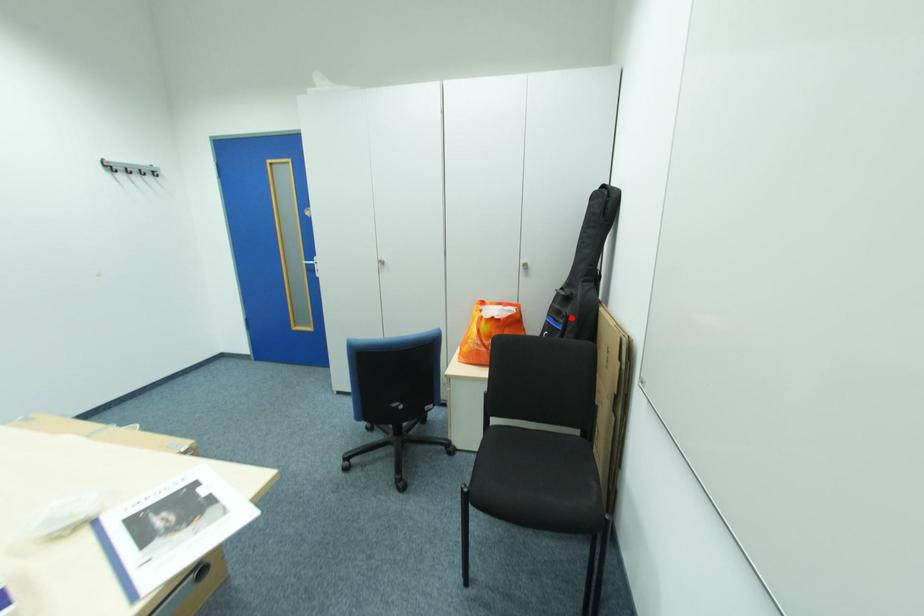
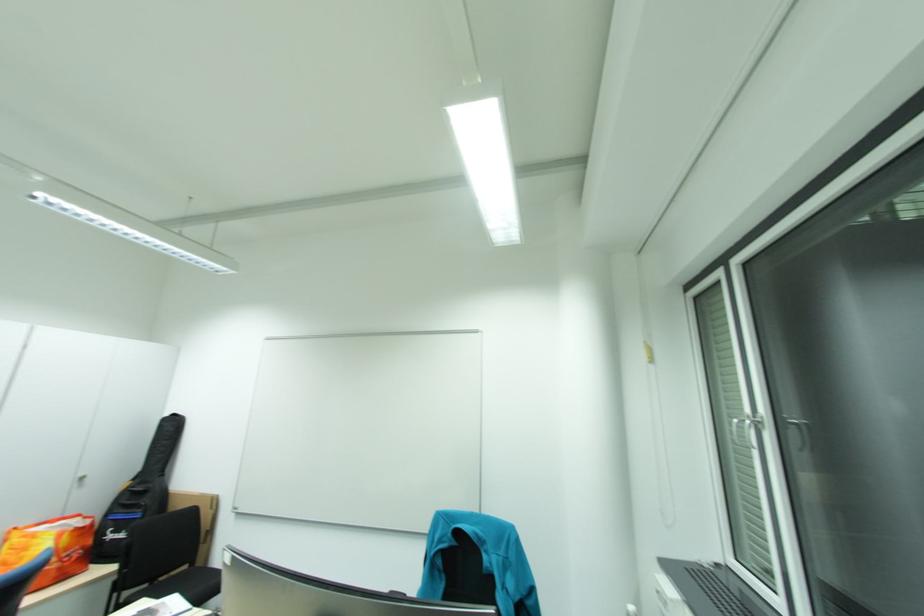
Question: I am providing you with two images of the same scene from different viewpoints. A red point is marked on the first image. At the location where the point appears in image 1, is it still visible in image 2?

Choices:
 (A) Yes
 (B) No

Answer: (A)